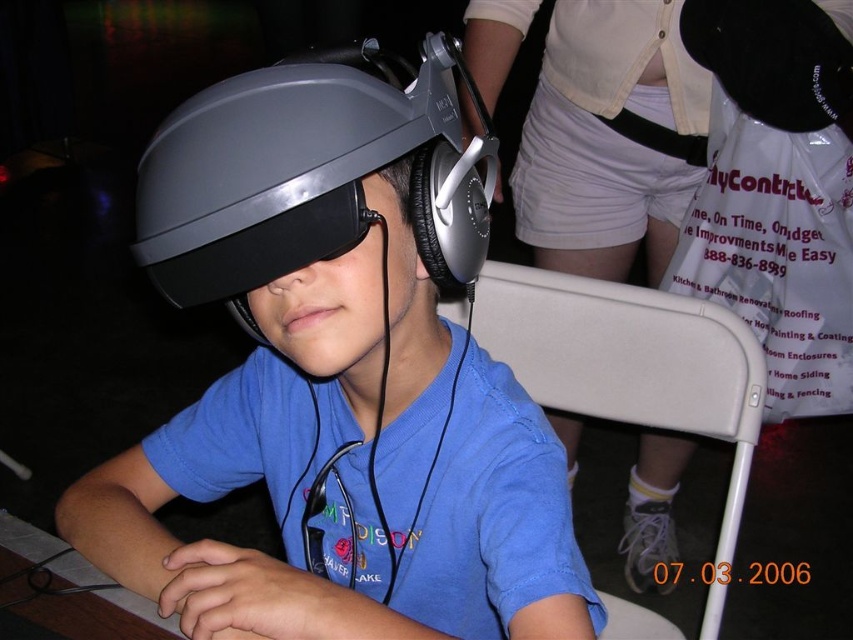
Question: Can you confirm if matte black headset at center is positioned to the right of matte black helmet at center?

Choices:
 (A) yes
 (B) no

Answer: (A)

Question: From the image, what is the correct spatial relationship of matte black headset at center in relation to matte black helmet at center?

Choices:
 (A) left
 (B) right

Answer: (B)

Question: Which object is closer to the camera taking this photo?

Choices:
 (A) matte black helmet at center
 (B) matte black headset at center

Answer: (A)

Question: Is matte black headset at center above matte black helmet at center?

Choices:
 (A) no
 (B) yes

Answer: (A)

Question: Which point is closer to the camera?

Choices:
 (A) matte black helmet at center
 (B) matte black headset at center

Answer: (A)

Question: Which point appears farthest from the camera in this image?

Choices:
 (A) (416, 404)
 (B) (265, 170)

Answer: (A)